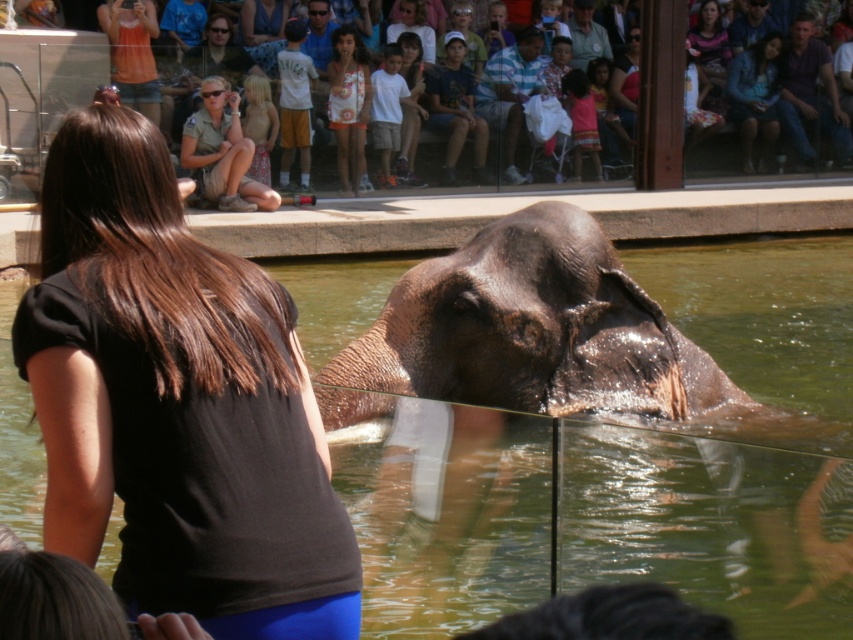
You are a zookeeper observing the scene. You need to determine which object is smaller between the black fabric shirt at center and the dark brown wrinkled skin elephant at center. Which one is smaller?

The black fabric shirt at center is smaller than the dark brown wrinkled skin elephant at center.

Looking at this image, you are a zookeeper who needs to ensure the safety of visitors. The woman is standing near the glass barrier. Considering the height difference between the green liquid water at elephant front and the black fabric shirt at center, which object is higher and might pose a risk of splashing onto the woman?

The green liquid water at elephant front has a greater height compared to the black fabric shirt at center. Since the water is higher, it poses a risk of splashing onto the woman standing near the glass barrier.